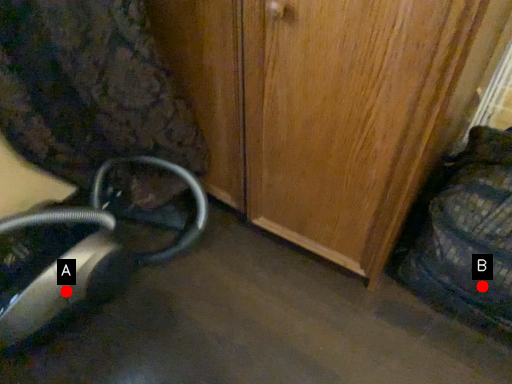
Question: Two points are circled on the image, labeled by A and B beside each circle. Which point is closer to the camera?

Choices:
 (A) A is closer
 (B) B is closer

Answer: (B)